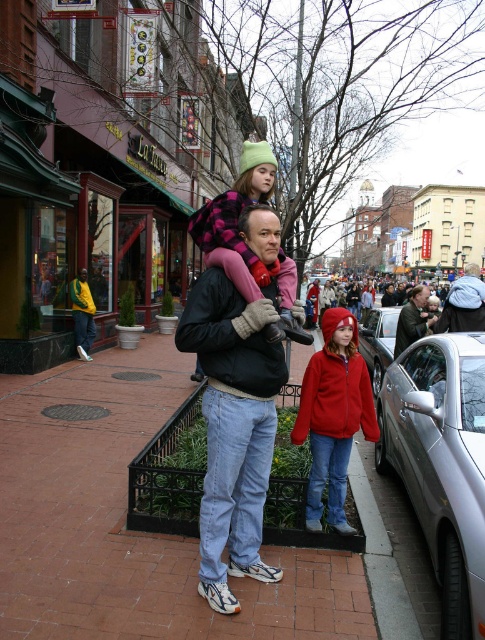
Who is lower down, red fleece jacket at center or silver metallic car at center?

red fleece jacket at center is lower down.

Which of these two, red fleece jacket at center or silver metallic car at center, stands taller?

With more height is red fleece jacket at center.

Which is in front, point (343, 467) or point (383, 342)?

Positioned in front is point (343, 467).

Where is `red fleece jacket at center`? The height and width of the screenshot is (640, 485). red fleece jacket at center is located at coordinates (334, 416).

Who is positioned more to the left, silver metallic car at right or yellow-green jacket at left?

Positioned to the left is yellow-green jacket at left.

Is silver metallic car at right to the right of yellow-green jacket at left from the viewer's perspective?

Yes, silver metallic car at right is to the right of yellow-green jacket at left.

Find the location of `silver metallic car at right`. silver metallic car at right is located at coordinates click(441, 464).

This screenshot has width=485, height=640. In order to click on silver metallic car at right in this screenshot , I will do `click(441, 464)`.

Does plush pink coat at center come in front of yellow-green jacket at left?

Yes, it is in front of yellow-green jacket at left.

Is plush pink coat at center wider than yellow-green jacket at left?

Indeed, plush pink coat at center has a greater width compared to yellow-green jacket at left.

Is point (291, 337) more distant than point (81, 296)?

No, it is in front of (81, 296).

Locate an element on the screen. plush pink coat at center is located at coordinates (237, 220).